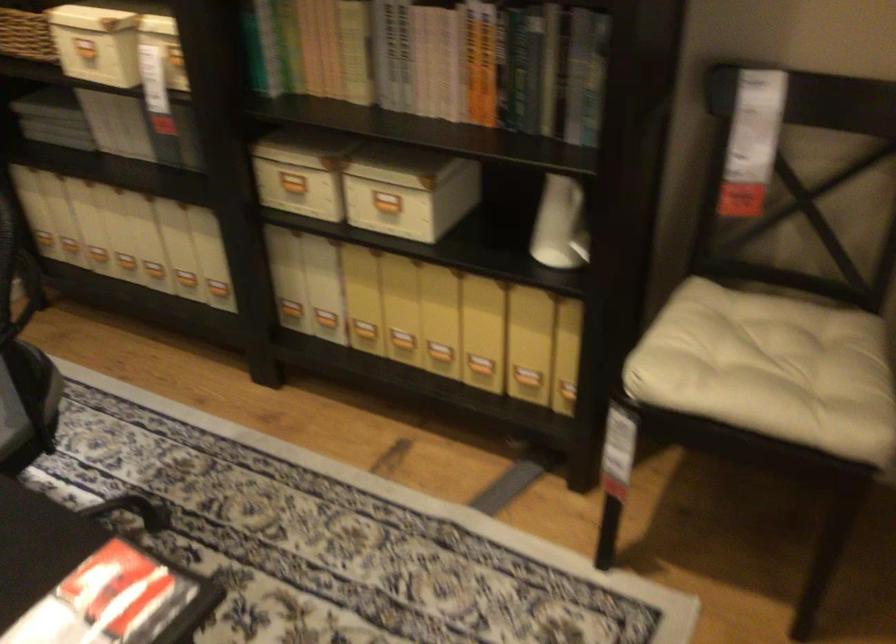
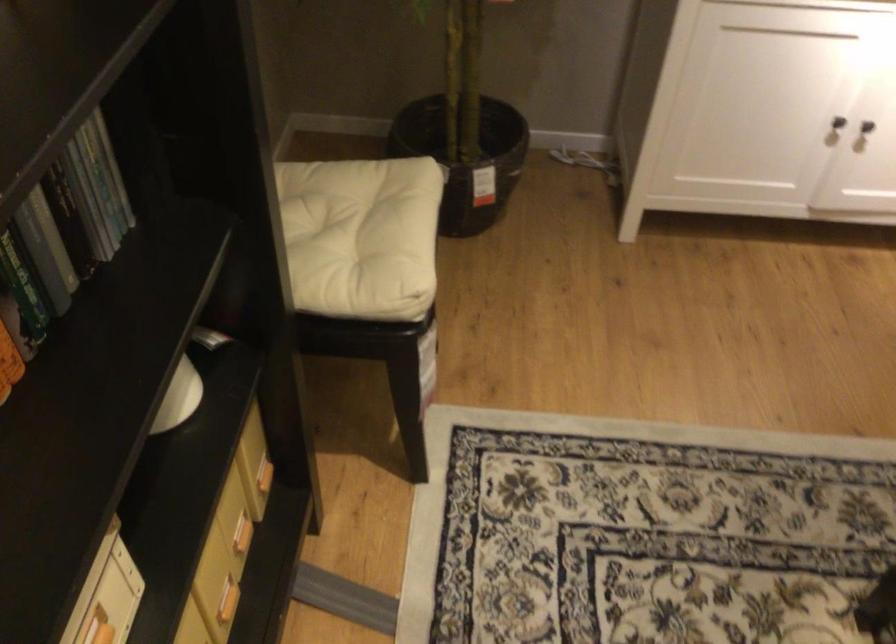
Find the pixel in the second image that matches point 565,98 in the first image.

(53, 238)